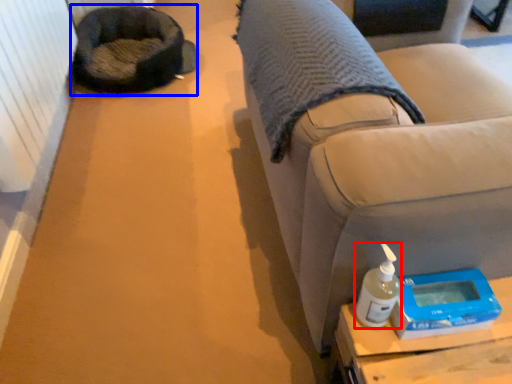
Question: Which point is closer to the camera, bottle (highlighted by a red box) or bean bag chair (highlighted by a blue box)?

Choices:
 (A) bottle
 (B) bean bag chair

Answer: (A)